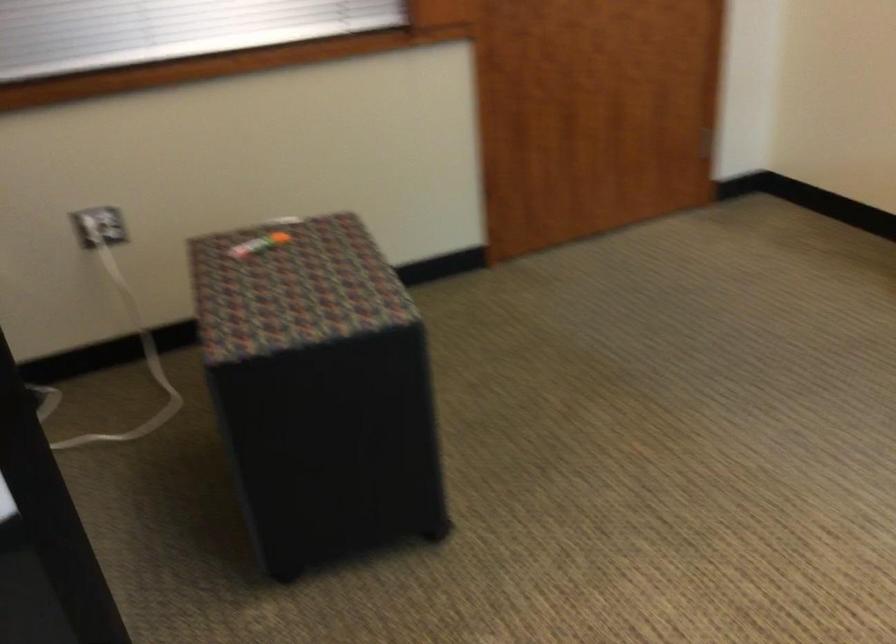
Where is `white electrical plug`? white electrical plug is located at coordinates (92, 231).